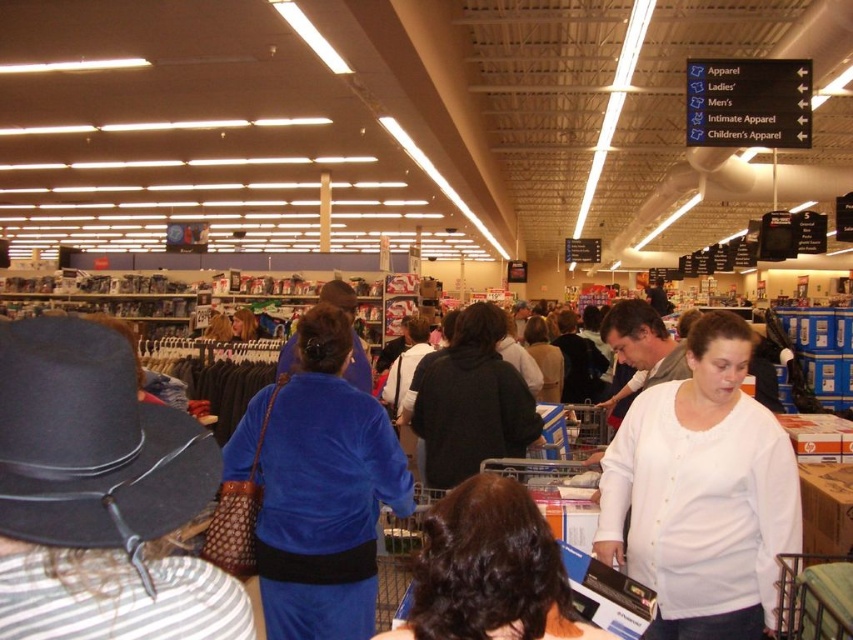
Question: Observing the image, what is the correct spatial positioning of brown curly hair at center in reference to dark gray hoodie at center?

Choices:
 (A) left
 (B) right

Answer: (A)

Question: Is brown curly hair at center below matte black shirt at center?

Choices:
 (A) no
 (B) yes

Answer: (B)

Question: Is brown curly hair at center further to the viewer compared to dark gray hoodie at center?

Choices:
 (A) yes
 (B) no

Answer: (B)

Question: Which of the following is the closest to the observer?

Choices:
 (A) (558, 372)
 (B) (525, 384)

Answer: (B)

Question: Considering the real-world distances, which object is closest to the brown curly hair at center?

Choices:
 (A) dark gray hoodie at center
 (B) matte black shirt at center
 (C) white matte shirt at center
 (D) velvet blue dress at center

Answer: (C)

Question: Which object appears farthest from the camera in this image?

Choices:
 (A) brown curly hair at center
 (B) dark gray hoodie at center
 (C) velvet blue dress at center
 (D) matte black shirt at center

Answer: (D)